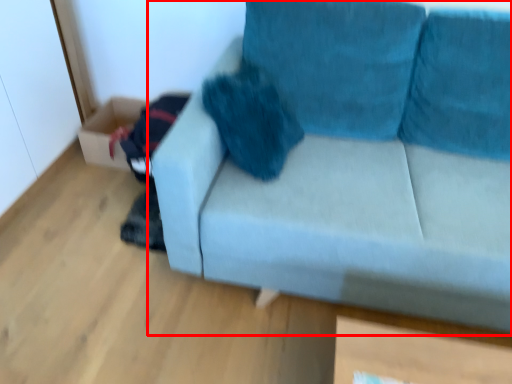
Question: Observing the image, what is the correct spatial positioning of studio couch (annotated by the red box) in reference to box?

Choices:
 (A) right
 (B) left

Answer: (A)